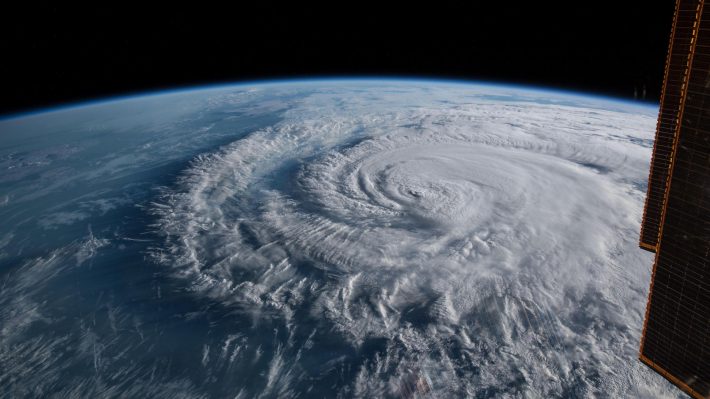
Where is `white surface`? The height and width of the screenshot is (399, 710). white surface is located at coordinates (508, 195), (457, 159), (376, 245).